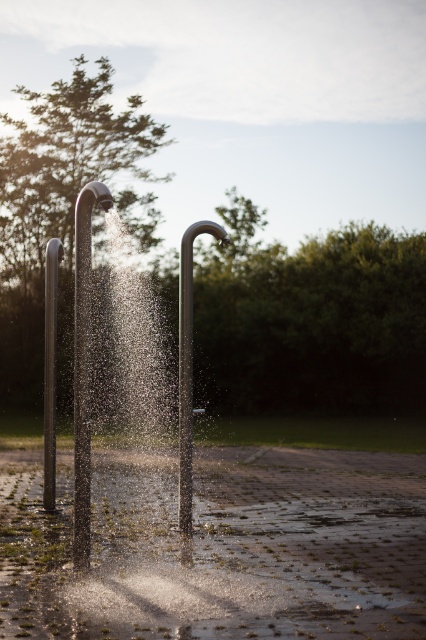
You are standing at the origin point in the image, which is the bottom left corner. The coordinates are given in normalized image coordinates where the bottom left is 0,0 and the top right is 1,1. You want to walk to the polished stainless steel shower head at center. What are the coordinates you need to walk to?

The coordinates you need to walk to are [187,364].

You are standing at the center of the paved area in the scene. There is a point marked at coordinates (x=83, y=365). What object is located at that point?

The satin silver shower head at center is located at point (x=83, y=365).

You are designing a layout for a public park and need to install two shower heads, the satin silver shower head at center and the polished stainless steel shower head at center. Based on their heights, which one should be placed closer to the ground to ensure they are both visible to users of different heights?

The satin silver shower head at center is shorter than the polished stainless steel shower head at center, so placing the shorter satin silver shower head at center closer to the ground will ensure both are visible to users of varying heights.